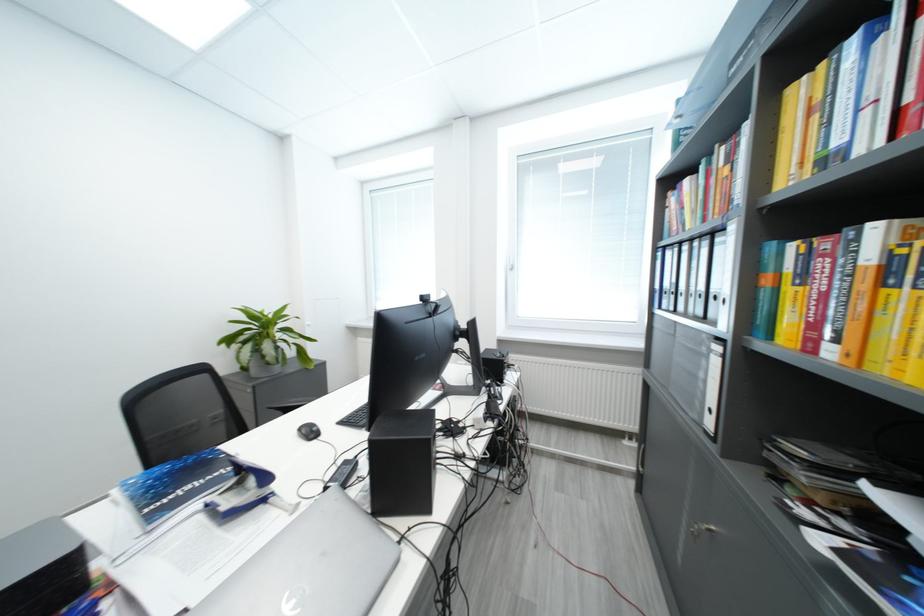
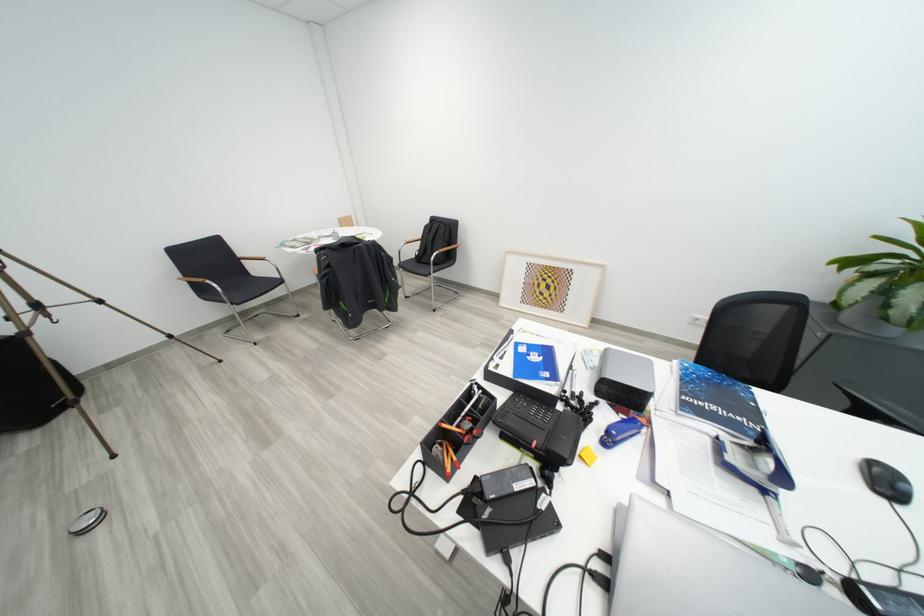
Find the pixel in the second image that matches pixel 152 511 in the first image.

(691, 395)